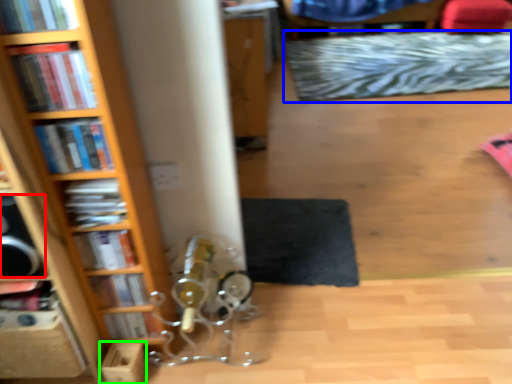
Question: Based on their relative distances, which object is farther from speaker (highlighted by a red box)? Choose from mat (highlighted by a blue box) and cardboard box (highlighted by a green box).

Choices:
 (A) mat
 (B) cardboard box

Answer: (A)